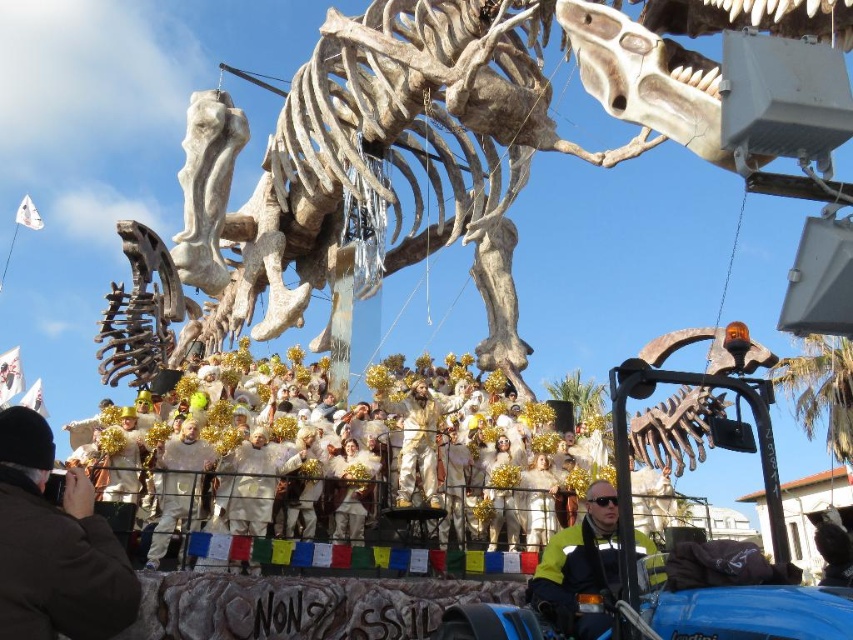
Question: Which point is farther to the camera?

Choices:
 (A) gold metallic costume at center
 (B) white fluffy costumes at center
 (C) natural bone dinosaur at upper center

Answer: (A)

Question: Which object is closer to the camera taking this photo?

Choices:
 (A) gold metallic costume at center
 (B) natural bone dinosaur at upper center

Answer: (B)

Question: Does natural bone dinosaur at upper center appear under white fluffy costumes at center?

Choices:
 (A) yes
 (B) no

Answer: (B)

Question: Can you confirm if natural bone dinosaur at upper center is positioned to the left of white fluffy costumes at center?

Choices:
 (A) yes
 (B) no

Answer: (B)

Question: Considering the relative positions of yellow reflective jacket at lower center and gold metallic costume at center in the image provided, where is yellow reflective jacket at lower center located with respect to gold metallic costume at center?

Choices:
 (A) right
 (B) left

Answer: (A)

Question: Which point appears closest to the camera in this image?

Choices:
 (A) (415, 472)
 (B) (332, 451)
 (C) (51, 600)

Answer: (C)